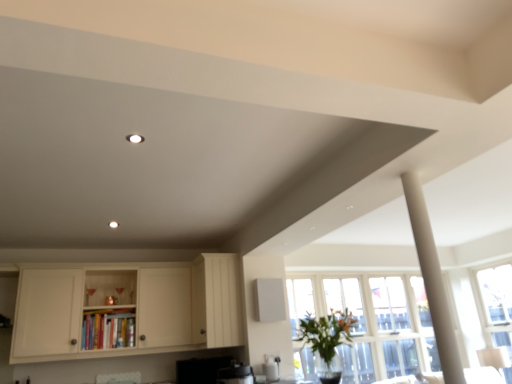
Question: From their relative heights in the image, would you say clear glass window at right is taller or shorter than white wood cabinet at center, which appears as the second cabinetry when viewed from the left?

Choices:
 (A) short
 (B) tall

Answer: (B)

Question: In the image, is clear glass window at right positioned in front of or behind white wood cabinet at center, which appears as the second cabinetry when viewed from the left?

Choices:
 (A) front
 (B) behind

Answer: (B)

Question: Estimate the real-world distances between objects in this image. Which object is closer to the white wood cabinet at center, which appears as the second cabinetry when viewed from the left?

Choices:
 (A) clear glass window at right
 (B) white matte cabinet at lower left, the 1th cabinetry viewed from the left
 (C) white matte column at right
 (D) green leafy plant at lower right

Answer: (B)

Question: Considering the real-world distances, which object is farthest from the white wood cabinet at center, which appears as the second cabinetry when viewed from the left?

Choices:
 (A) white matte cabinet at lower left, the 1th cabinetry viewed from the left
 (B) clear glass window at right
 (C) white matte column at right
 (D) green leafy plant at lower right

Answer: (B)